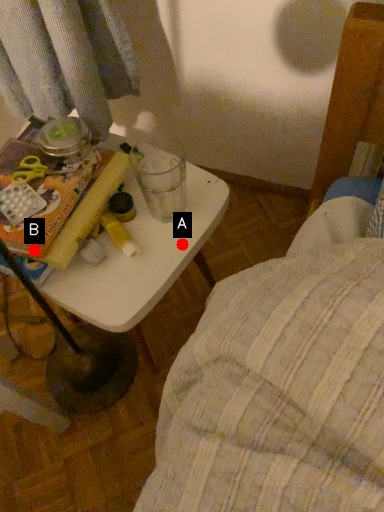
Question: Two points are circled on the image, labeled by A and B beside each circle. Which point is closer to the camera taking this photo?

Choices:
 (A) A is closer
 (B) B is closer

Answer: (B)